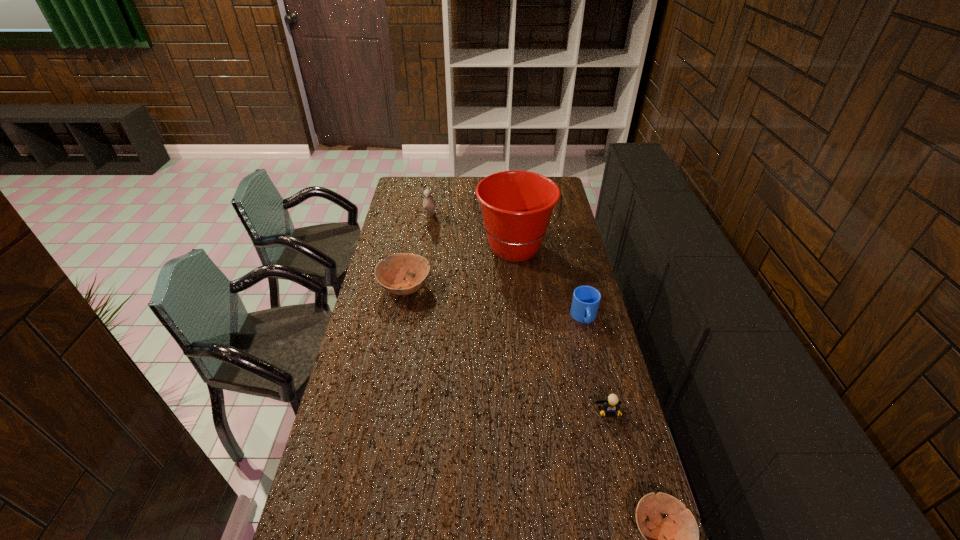
What are the coordinates of `free spot between the taller bowl and the mug` in the screenshot? It's located at (494, 302).

Locate an element on the screen. free spot between the Lego and the taller bowl is located at coordinates (507, 350).

At what (x,y) coordinates should I click in order to perform the action: click on free spot between the fifth farthest object and the bucket. Please return your answer as a coordinate pair (x, y). Looking at the image, I should click on (562, 330).

Where is `vacant space that is in between the fifth farthest object and the taller bowl`? vacant space that is in between the fifth farthest object and the taller bowl is located at coordinates (507, 350).

Where is `empty space between the Lego and the mug`? empty space between the Lego and the mug is located at coordinates (596, 365).

You are a GUI agent. You are given a task and a screenshot of the screen. Output one action in this format:
    pyautogui.click(x=<x>, y=<y>)
    Task: Click on the free area in between the taller bowl and the bird
    The image size is (960, 540).
    Given the screenshot: What is the action you would take?
    pyautogui.click(x=418, y=253)

The width and height of the screenshot is (960, 540). In order to click on free spot between the farther bowl and the second nearest object in this screenshot , I will do `click(507, 350)`.

Identify which object is the second closest to the Lego. Please provide its 2D coordinates. Your answer should be formatted as a tuple, i.e. [(x, y)], where the tuple contains the x and y coordinates of a point satisfying the conditions above.

[(586, 299)]

Choose which object is the fifth nearest neighbor to the shorter bowl. Please provide its 2D coordinates. Your answer should be formatted as a tuple, i.e. [(x, y)], where the tuple contains the x and y coordinates of a point satisfying the conditions above.

[(429, 204)]